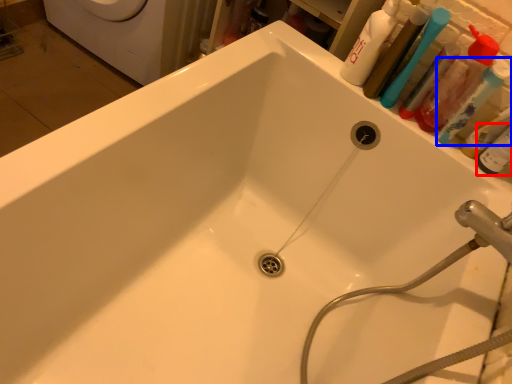
Question: Which object is further to the camera taking this photo, toiletry (highlighted by a red box) or toothbrush (highlighted by a blue box)?

Choices:
 (A) toiletry
 (B) toothbrush

Answer: (B)